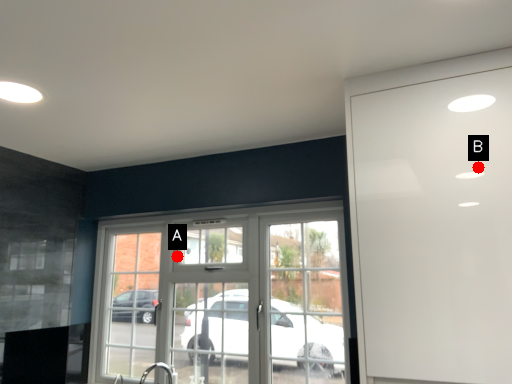
Question: Two points are circled on the image, labeled by A and B beside each circle. Which of the following is the farthest from the observer?

Choices:
 (A) A is further
 (B) B is further

Answer: (A)